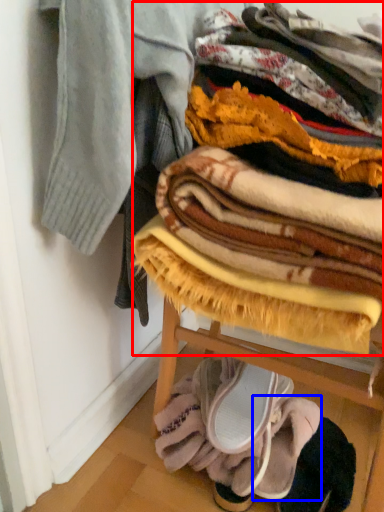
Question: Among these objects, which one is farthest to the camera, blanket (highlighted by a red box) or footwear (highlighted by a blue box)?

Choices:
 (A) blanket
 (B) footwear

Answer: (B)